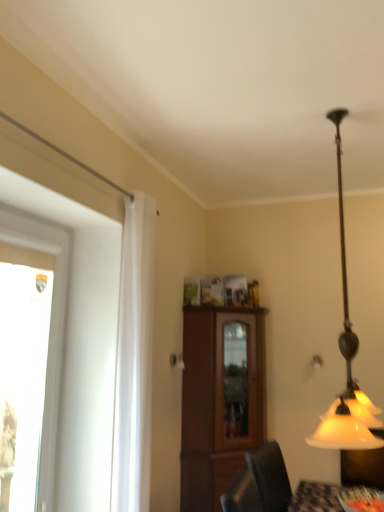
Question: Is transparent glass window at left closer to camera compared to matte glass lampshade at right?

Choices:
 (A) yes
 (B) no

Answer: (B)

Question: Is transparent glass window at left wider than matte glass lampshade at right?

Choices:
 (A) yes
 (B) no

Answer: (B)

Question: From the image's perspective, is transparent glass window at left under matte glass lampshade at right?

Choices:
 (A) no
 (B) yes

Answer: (B)

Question: Does transparent glass window at left have a smaller size compared to matte glass lampshade at right?

Choices:
 (A) no
 (B) yes

Answer: (B)

Question: Can you confirm if transparent glass window at left is bigger than matte glass lampshade at right?

Choices:
 (A) yes
 (B) no

Answer: (B)

Question: From a real-world perspective, is transparent glass window at left below matte glass lampshade at right?

Choices:
 (A) no
 (B) yes

Answer: (B)

Question: Does white sheer curtain at left come in front of brown wood cabinet at center?

Choices:
 (A) yes
 (B) no

Answer: (A)

Question: Considering the relative sizes of white sheer curtain at left and brown wood cabinet at center in the image provided, is white sheer curtain at left taller than brown wood cabinet at center?

Choices:
 (A) yes
 (B) no

Answer: (A)

Question: Is white sheer curtain at left positioned far away from brown wood cabinet at center?

Choices:
 (A) yes
 (B) no

Answer: (A)

Question: Is white sheer curtain at left wider than brown wood cabinet at center?

Choices:
 (A) no
 (B) yes

Answer: (A)

Question: Is white sheer curtain at left thinner than brown wood cabinet at center?

Choices:
 (A) yes
 (B) no

Answer: (A)

Question: Can you confirm if white sheer curtain at left is positioned to the left of brown wood cabinet at center?

Choices:
 (A) no
 (B) yes

Answer: (B)

Question: From the image's perspective, is brown wood cabinet at center below white sheer curtain at left?

Choices:
 (A) yes
 (B) no

Answer: (A)